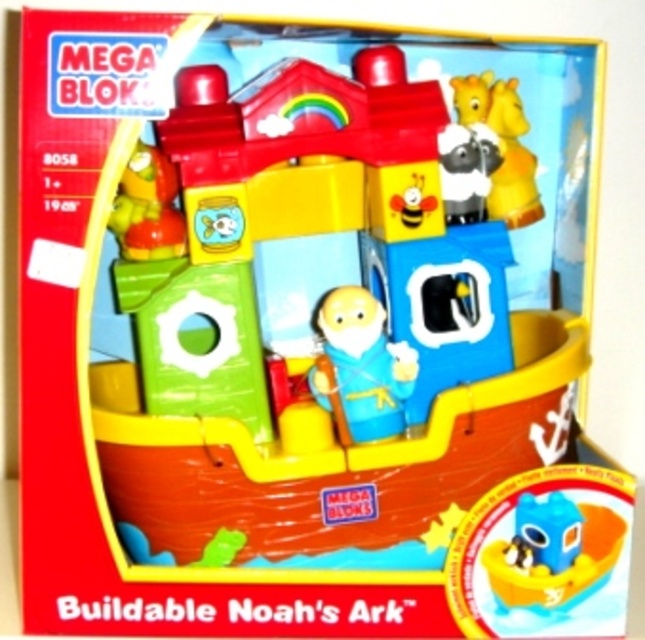
Does blue matte noah figure at center have a smaller size compared to white plush sheep at upper center?

No.

You are a GUI agent. You are given a task and a screenshot of the screen. Output one action in this format:
    pyautogui.click(x=<x>, y=<y>)
    Task: Click on the blue matte noah figure at center
    This screenshot has height=640, width=645.
    Given the screenshot: What is the action you would take?
    pyautogui.click(x=361, y=364)

Is point (404, 353) in front of point (466, 198)?

Yes, point (404, 353) is in front of point (466, 198).

Where is `blue matte noah figure at center`? blue matte noah figure at center is located at coordinates (361, 364).

I want to click on blue matte noah figure at center, so click(x=361, y=364).

Based on the photo, is blue matte noah figure at center wider than smooth plastic pirate hat at upper left?

Yes, blue matte noah figure at center is wider than smooth plastic pirate hat at upper left.

Locate an element on the screen. blue matte noah figure at center is located at coordinates (361, 364).

Which of these two, blue plastic boat at center or blue matte noah figure at center, stands taller?

Standing taller between the two is blue matte noah figure at center.

Between point (600, 525) and point (397, 390), which one is positioned in front?

Point (600, 525) is in front.

This screenshot has height=640, width=645. I want to click on blue plastic boat at center, so click(553, 550).

The height and width of the screenshot is (640, 645). I want to click on blue plastic boat at center, so click(x=553, y=550).